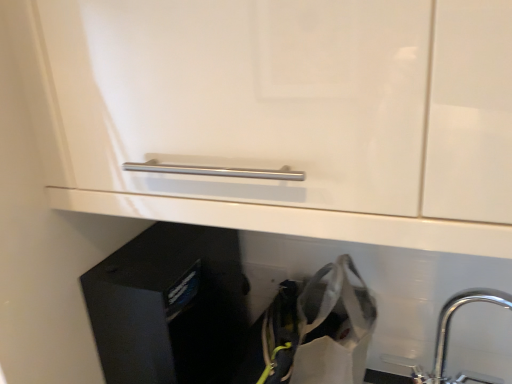
Question: Is black matte file cabinet at lower left wider or thinner than white fabric shopping bag at lower right?

Choices:
 (A) wide
 (B) thin

Answer: (A)

Question: Does point (112, 261) appear closer or farther from the camera than point (354, 311)?

Choices:
 (A) closer
 (B) farther

Answer: (B)

Question: Which is farther from the white fabric shopping bag at lower right?

Choices:
 (A) chrome metallic tap at lower right
 (B) black matte file cabinet at lower left

Answer: (B)

Question: Estimate the real-world distances between objects in this image. Which object is closer to the black matte file cabinet at lower left?

Choices:
 (A) white fabric shopping bag at lower right
 (B) chrome metallic tap at lower right

Answer: (A)